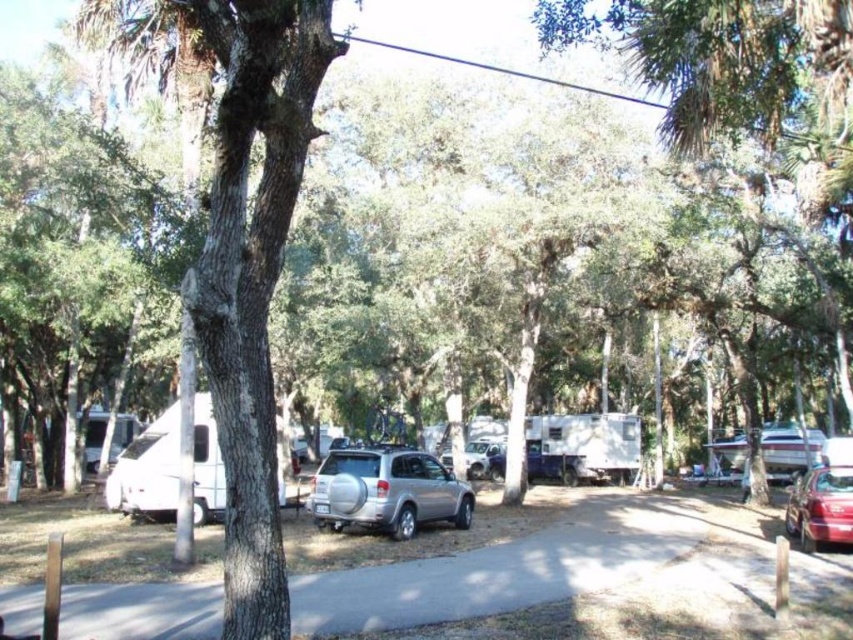
You are a hiker planning to walk along the paved pathway bordered by wooden posts. You want to go from the smooth bark tree at left to the shiny red sedan at lower right. Which direction should you head?

The smooth bark tree at left is to the left of the shiny red sedan at lower right, so you should head to the right to reach the shiny red sedan at lower right from the smooth bark tree at left.

You are a hiker carrying a 10 foot long ladder. You need to move the ladder from the smooth bark tree at left to the silver metallic suv at center. Can you move the ladder horizontally between them without tilting it?

The smooth bark tree at left and silver metallic suv at center are 34.77 feet apart from each other, so yes, the ladder can be moved horizontally between them without tilting since the distance is greater than the ladder length.

You are a delivery person trying to park your 2.5 meter tall truck in this campsite. The white matte camper at left and the satin silver suv at center are already parked. Which vehicle should you avoid parking next to if you need to maintain a 1 meter clearance above your truck?

The white matte camper at left is much taller than the satin silver suv at center. Since your truck is 2.5 meters tall, you should avoid parking next to the white matte camper at left to ensure there is enough clearance above your truck.